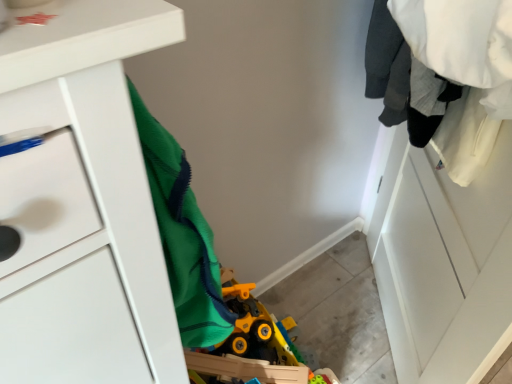
Question: Should I look upward or downward to see white matte chest of drawers at left?

Choices:
 (A) down
 (B) up

Answer: (A)

Question: Can you confirm if white matte chest of drawers at left is thinner than white matte clothes at upper right?

Choices:
 (A) no
 (B) yes

Answer: (A)

Question: Is the surface of white matte chest of drawers at left in direct contact with white matte clothes at upper right?

Choices:
 (A) no
 (B) yes

Answer: (A)

Question: Does white matte chest of drawers at left have a greater height compared to white matte clothes at upper right?

Choices:
 (A) yes
 (B) no

Answer: (B)

Question: Is white matte chest of drawers at left not close to white matte clothes at upper right?

Choices:
 (A) no
 (B) yes

Answer: (A)

Question: Is white matte chest of drawers at left not within white matte clothes at upper right?

Choices:
 (A) no
 (B) yes

Answer: (B)

Question: Considering the relative positions of white matte chest of drawers at left and white matte clothes at upper right in the image provided, is white matte chest of drawers at left in front of white matte clothes at upper right?

Choices:
 (A) yes
 (B) no

Answer: (A)

Question: Is white matte clothes at upper right closer to camera compared to white matte chest of drawers at left?

Choices:
 (A) yes
 (B) no

Answer: (B)

Question: From the image's perspective, is white matte clothes at upper right beneath white matte chest of drawers at left?

Choices:
 (A) no
 (B) yes

Answer: (B)

Question: From a real-world perspective, is white matte clothes at upper right positioned over white matte chest of drawers at left based on gravity?

Choices:
 (A) yes
 (B) no

Answer: (B)

Question: Could white matte chest of drawers at left be considered to be inside white matte clothes at upper right?

Choices:
 (A) yes
 (B) no

Answer: (B)

Question: Is white matte clothes at upper right at the right side of white matte chest of drawers at left?

Choices:
 (A) yes
 (B) no

Answer: (A)

Question: Is white matte clothes at upper right not near white matte chest of drawers at left?

Choices:
 (A) no
 (B) yes

Answer: (A)

Question: Considering the positions of point (481, 187) and point (35, 278), is point (481, 187) closer or farther from the camera than point (35, 278)?

Choices:
 (A) closer
 (B) farther

Answer: (B)